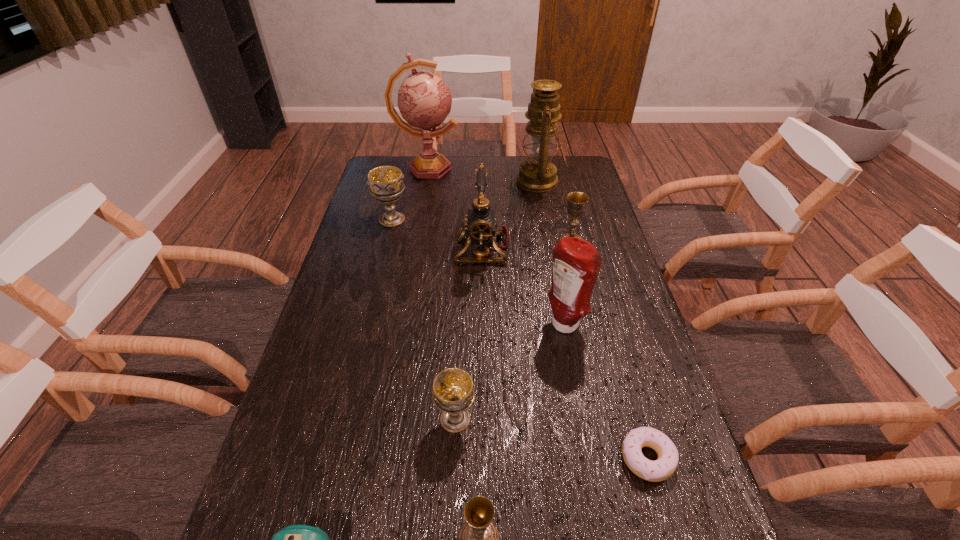
The height and width of the screenshot is (540, 960). Identify the location of the third farthest chalice. (453, 393).

The width and height of the screenshot is (960, 540). I want to click on the shortest object, so click(661, 469).

Locate an element on the screen. The height and width of the screenshot is (540, 960). doughnut is located at coordinates (661, 469).

The width and height of the screenshot is (960, 540). I want to click on free space located 0.200m on the front-facing side of the pink globe, so click(x=507, y=168).

I want to click on free region located 0.070m on the back of the oil lamp, so click(x=535, y=157).

Where is `vacant space located on the back of the red condiment`? The width and height of the screenshot is (960, 540). vacant space located on the back of the red condiment is located at coordinates (549, 240).

The height and width of the screenshot is (540, 960). I want to click on vacant space positioned 0.300m on the front of the telephone, featuring the rotary dial, so click(362, 248).

This screenshot has width=960, height=540. Identify the location of free space located on the front of the telephone, featuring the rotary dial. (362, 248).

You are a GUI agent. You are given a task and a screenshot of the screen. Output one action in this format:
    pyautogui.click(x=<x>, y=<y>)
    Task: Click on the free space located 0.250m on the front of the telephone, featuring the rotary dial
    The width and height of the screenshot is (960, 540).
    Given the screenshot: What is the action you would take?
    pyautogui.click(x=377, y=248)

Locate an element on the screen. free point located on the back of the rightmost chalice is located at coordinates (563, 209).